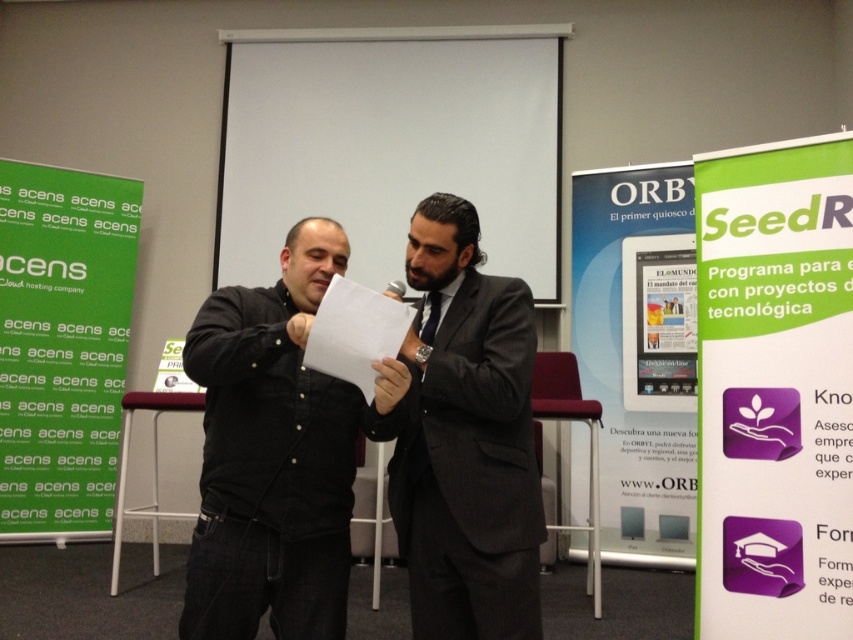
You are an event planner looking at the image. You need to determine the spatial arrangement of the green paper at upper right and the blue glossy poster at center. Which object is located to the right of the other?

The green paper at upper right is positioned on the right side of blue glossy poster at center, so the green paper at upper right is to the right of the blue glossy poster at center.